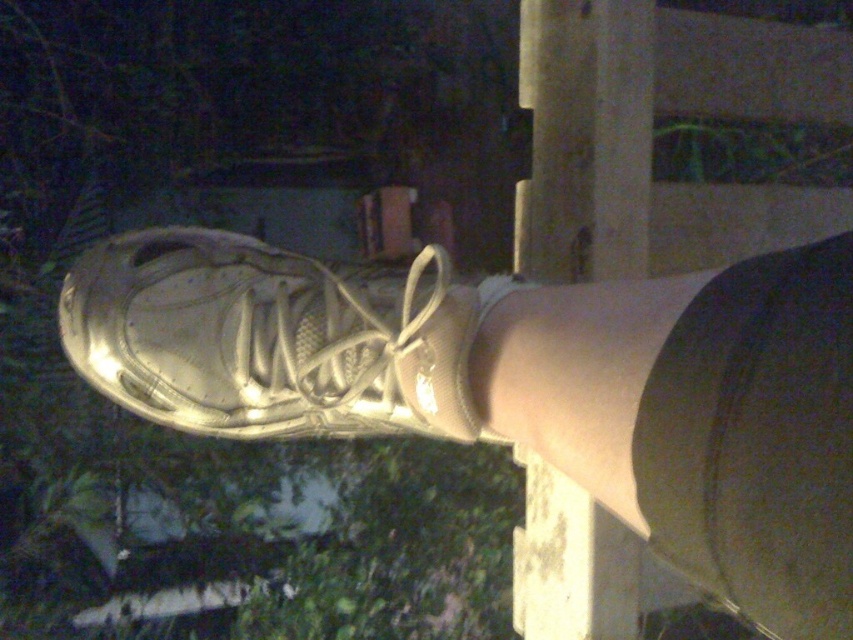
Based on the photo, who is more forward, (149, 332) or (555, 497)?

Positioned in front is point (149, 332).

Which is below, white mesh shoe at center or smooth concrete pole at center?

white mesh shoe at center is below.

Is point (293, 324) positioned in front of point (630, 22)?

Yes, point (293, 324) is in front of point (630, 22).

At what (x,y) coordinates should I click in order to perform the action: click on white mesh shoe at center. Please return your answer as a coordinate pair (x, y). Looking at the image, I should click on (270, 339).

Who is positioned more to the right, metallic gold shoe at center or white mesh shoe at center?

metallic gold shoe at center

The height and width of the screenshot is (640, 853). What do you see at coordinates (524, 387) in the screenshot?
I see `metallic gold shoe at center` at bounding box center [524, 387].

This screenshot has height=640, width=853. Identify the location of metallic gold shoe at center. (524, 387).

Where is `metallic gold shoe at center`? metallic gold shoe at center is located at coordinates (524, 387).